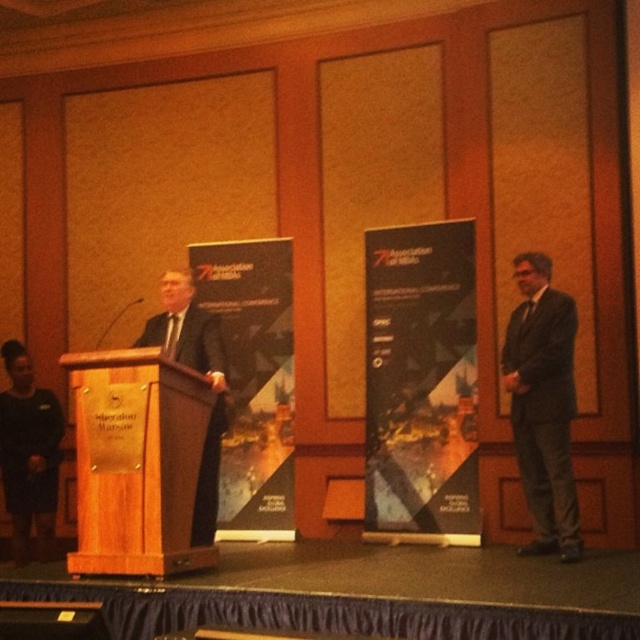
Question: Is dark gray suit at right wider than black suit at left?

Choices:
 (A) no
 (B) yes

Answer: (A)

Question: Does dark gray suit at right lie in front of black suit at left?

Choices:
 (A) no
 (B) yes

Answer: (B)

Question: Can you confirm if black suit at left is wider than matte black suit at left?

Choices:
 (A) yes
 (B) no

Answer: (A)

Question: Which point is closer to the camera?

Choices:
 (A) matte black suit at left
 (B) black suit at left

Answer: (A)

Question: Which point is farther to the camera?

Choices:
 (A) (544, 365)
 (B) (49, 506)
 (C) (179, 570)
 (D) (200, 497)

Answer: (B)

Question: Which point is farther from the camera taking this photo?

Choices:
 (A) (208, 520)
 (B) (148, 570)

Answer: (A)